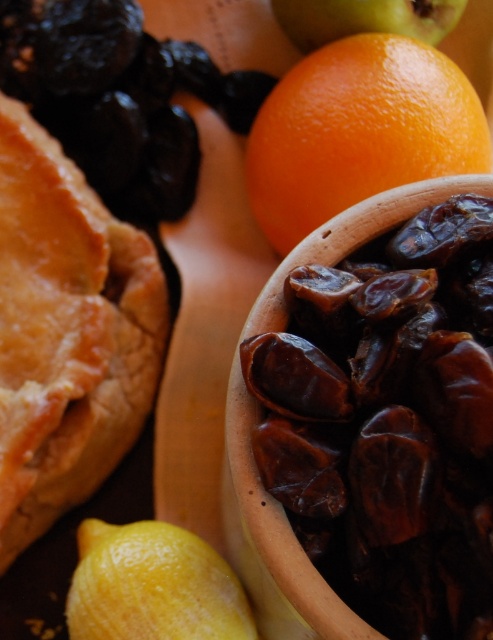
You are preparing a citrus garnish for a dessert and have a yellow matte lemon at lower left and a smooth orange at upper center on the table. Which citrus fruit is taller?

The yellow matte lemon at lower left is much taller than the smooth orange at upper center.

What is the 2D coordinate of the orange matte at upper right in the image?

The orange matte at upper right is located at the coordinate point of (358, 131).